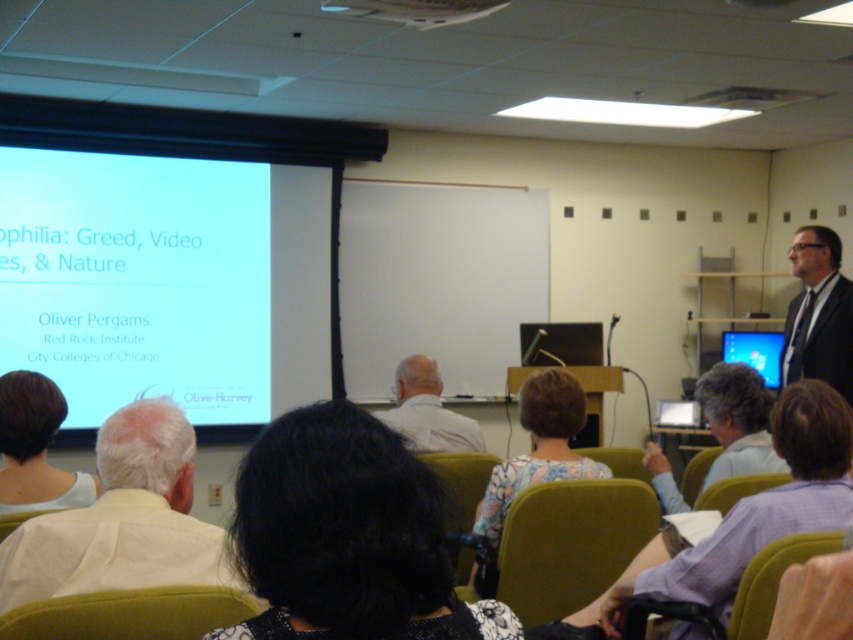
You are a photographer standing in the back of the classroom. You want to take a photo of the blue glossy monitor at right without including the black hair at center in the frame. Which direction should you move to achieve this?

Move to the right side of the classroom. Since the black hair at center is to the left of the blue glossy monitor at right, moving right will position you away from the black hair at center, allowing you to frame the blue glossy monitor at right without obstruction.